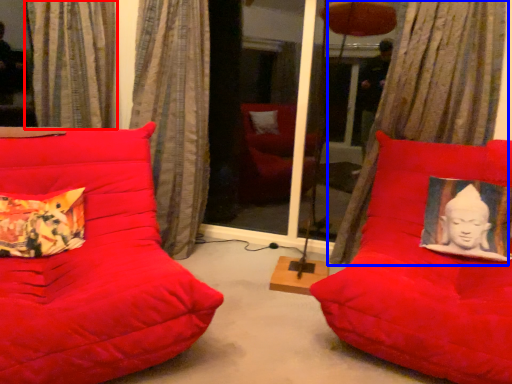
Question: Which of the following is the closest to the observer, curtain (highlighted by a red box) or curtain (highlighted by a blue box)?

Choices:
 (A) curtain
 (B) curtain

Answer: (B)